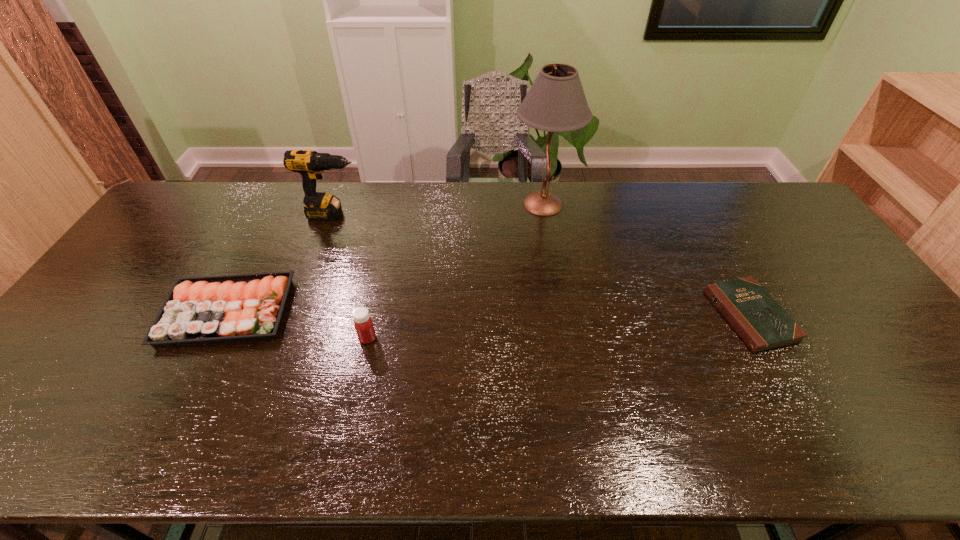
Locate an element on the screen. This screenshot has width=960, height=540. table lamp is located at coordinates (556, 102).

You are a GUI agent. You are given a task and a screenshot of the screen. Output one action in this format:
    pyautogui.click(x=<x>, y=<y>)
    Task: Click on the tallest object
    
    Given the screenshot: What is the action you would take?
    coord(556,102)

Find the location of a particular element. Image resolution: width=960 pixels, height=540 pixels. the second tallest object is located at coordinates (310, 164).

I want to click on medicine, so click(364, 327).

The height and width of the screenshot is (540, 960). In order to click on the third shortest object in this screenshot , I will do `click(364, 327)`.

The width and height of the screenshot is (960, 540). Identify the location of platter. (208, 310).

This screenshot has height=540, width=960. Identify the location of Bible. (763, 325).

Identify the location of the shortest object. This screenshot has width=960, height=540. (763, 325).

Where is `free space located 0.270m on the front-facing side of the tallest object`? Image resolution: width=960 pixels, height=540 pixels. free space located 0.270m on the front-facing side of the tallest object is located at coordinates (434, 204).

Locate an element on the screen. The width and height of the screenshot is (960, 540). vacant space located 0.170m on the front-facing side of the tallest object is located at coordinates (462, 204).